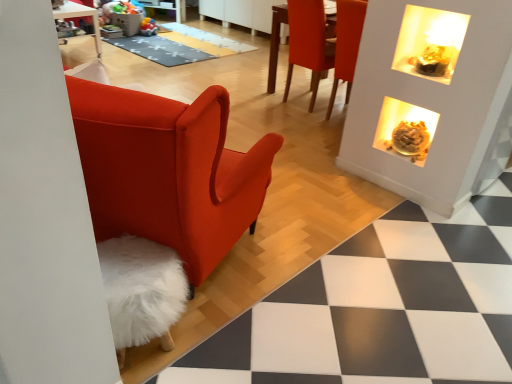
Find the location of a particular element. free point in front of matte orange chair at upper right is located at coordinates (291, 118).